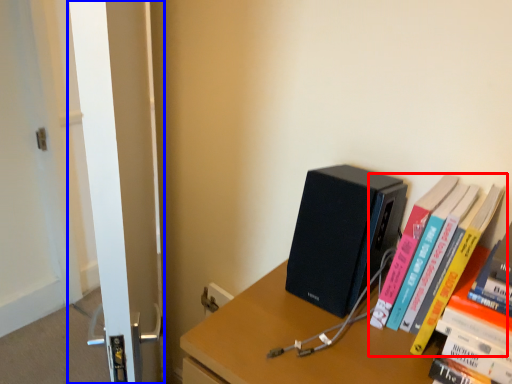
Question: Which object is further to the camera taking this photo, book (highlighted by a red box) or screen door (highlighted by a blue box)?

Choices:
 (A) book
 (B) screen door

Answer: (A)